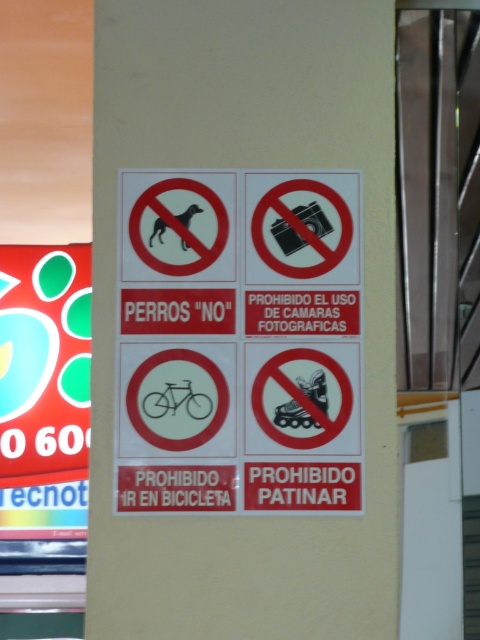
Question: Is black paper sign at center positioned in front of red glossy poster at left?

Choices:
 (A) yes
 (B) no

Answer: (A)

Question: Is black paper sign at center positioned in front of red glossy poster at left?

Choices:
 (A) no
 (B) yes

Answer: (B)

Question: Is black paper sign at center positioned in front of red glossy poster at left?

Choices:
 (A) yes
 (B) no

Answer: (A)

Question: Which of the following is the farthest from the observer?

Choices:
 (A) red glossy poster at left
 (B) black paper sign at center

Answer: (A)